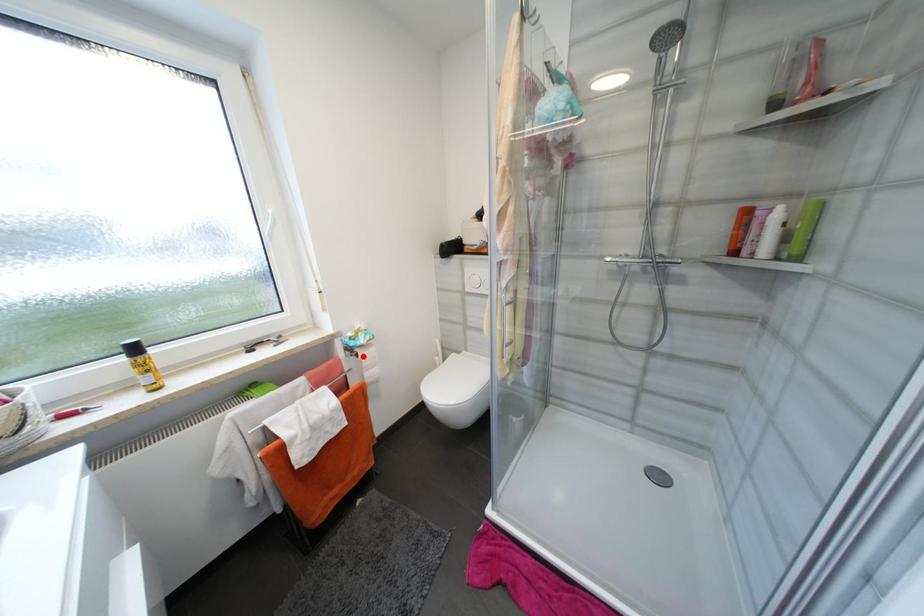
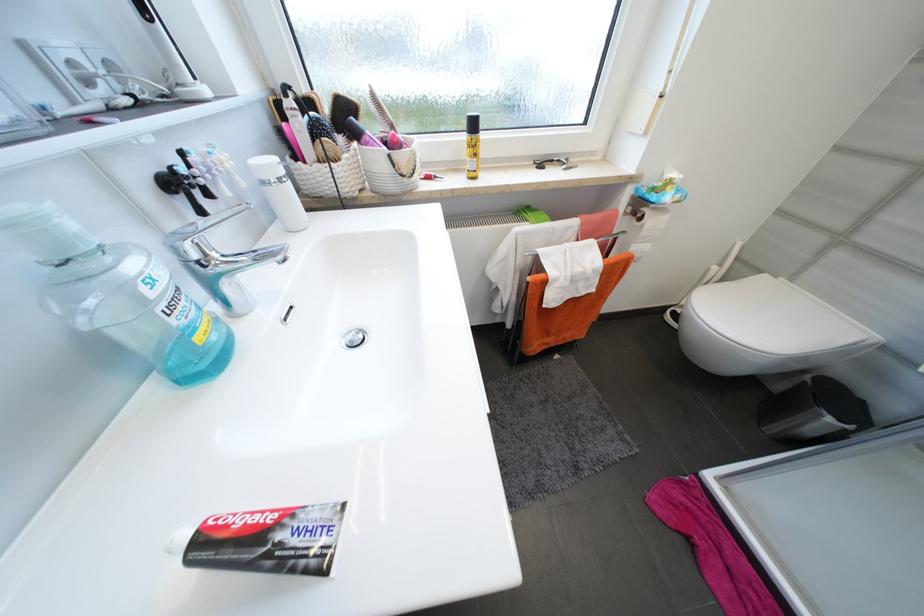
The point at the highlighted location is marked in the first image. Where is the corresponding point in the second image?

(647, 219)